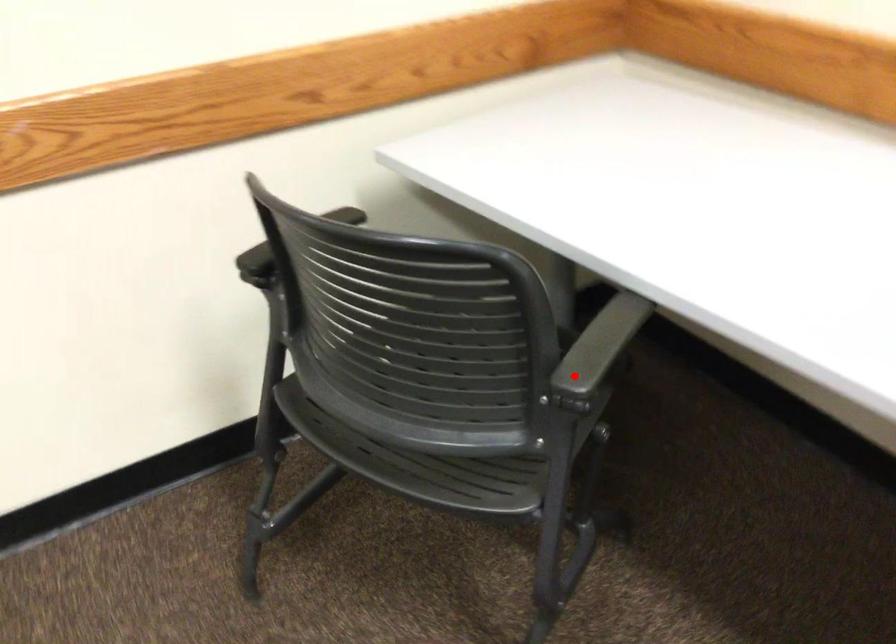
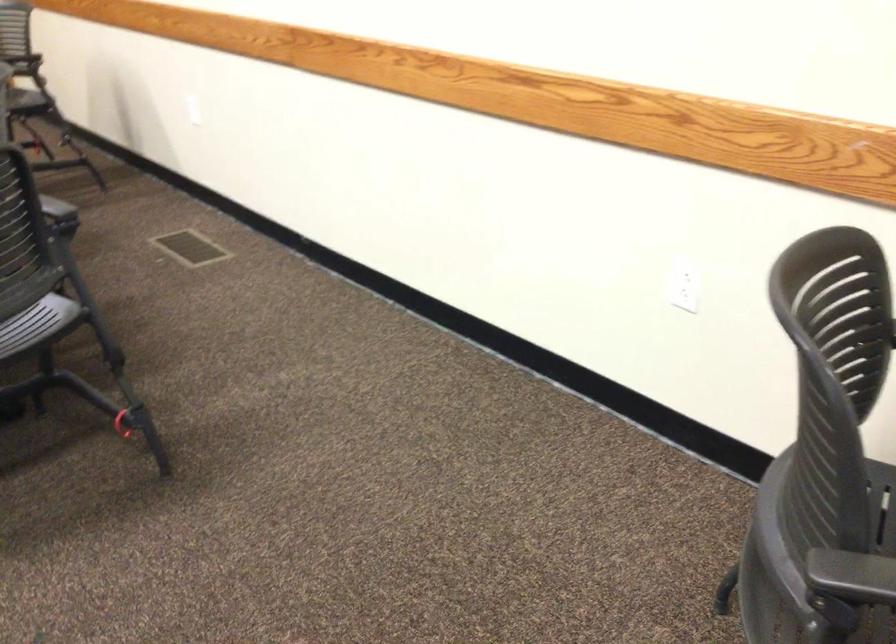
Question: I am providing you with two images of the same scene from different viewpoints. A red point is shown in image1. For the corresponding object point in image2, is it positioned nearer or farther from the camera?

Choices:
 (A) Nearer
 (B) Farther

Answer: (A)